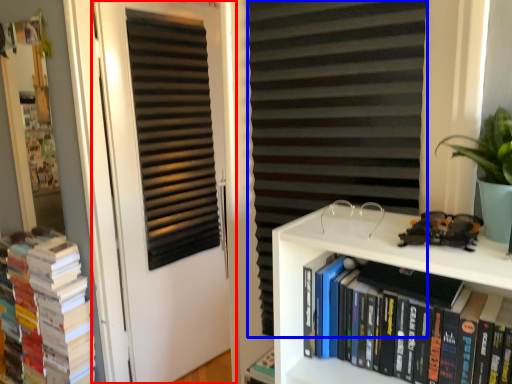
Question: Which object is further to the camera taking this photo, door (highlighted by a red box) or curtain (highlighted by a blue box)?

Choices:
 (A) door
 (B) curtain

Answer: (A)